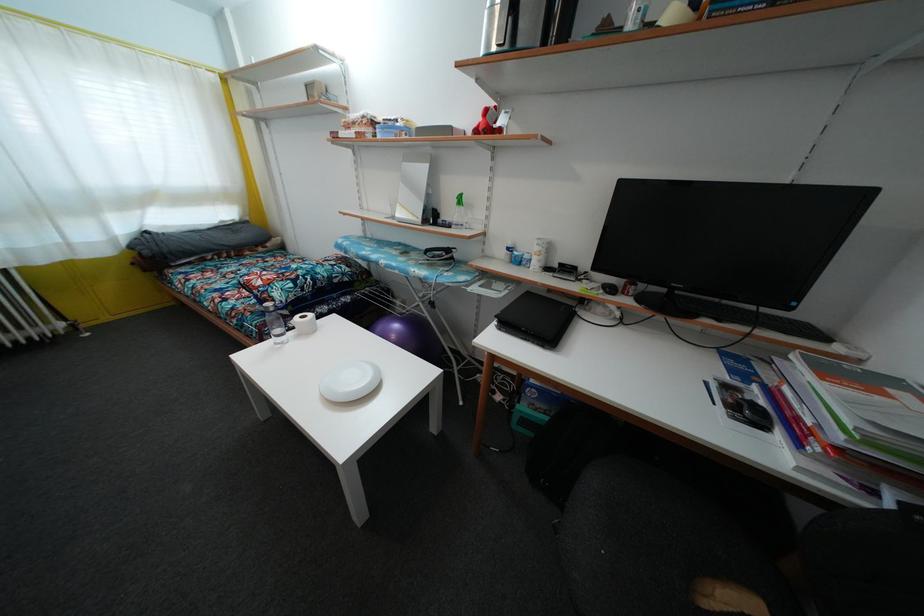
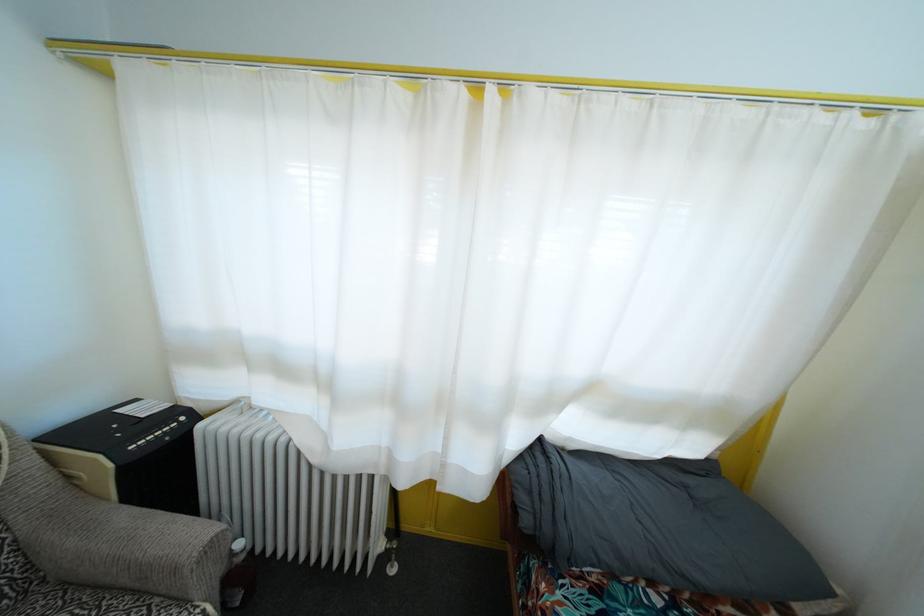
Question: I am providing you with two images of the same scene from different viewpoints. After the viewpoint changes to image2, which objects are now occluded?

Choices:
 (A) white curtain
 (B) machine paper slot
 (C) grey blanket
 (D) none of these

Answer: (D)